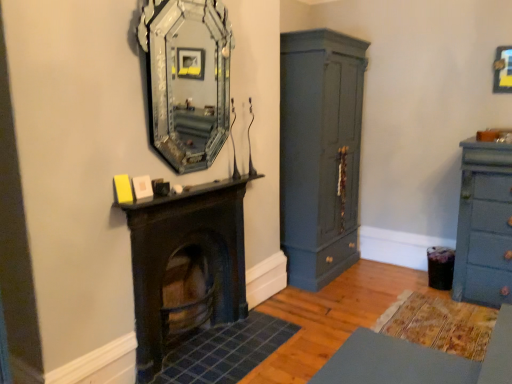
What do you see at coordinates (188, 79) in the screenshot?
I see `silver mirrored frame at upper center` at bounding box center [188, 79].

Where is `matte blue dresser at right`? matte blue dresser at right is located at coordinates (484, 225).

I want to click on dark wood fireplace at center, so click(x=186, y=266).

Image resolution: width=512 pixels, height=384 pixels. Identify the location of metallic gold picture frame at upper right. (503, 70).

The height and width of the screenshot is (384, 512). I want to click on chest of drawers below the silver mirrored frame at upper center (from the image's perspective), so click(x=484, y=225).

Looking at this image, from the image's perspective, is silver mirrored frame at upper center located above or below matte blue dresser at right?

Based on their image positions, silver mirrored frame at upper center is located above matte blue dresser at right.

Can you confirm if silver mirrored frame at upper center is wider than matte blue dresser at right?

No, silver mirrored frame at upper center is not wider than matte blue dresser at right.

Does point (169, 231) appear closer or farther from the camera than point (499, 90)?

Point (169, 231).

Is dark wood fireplace at center bigger than metallic gold picture frame at upper right?

Yes.

In terms of width, does dark wood fireplace at center look wider or thinner when compared to metallic gold picture frame at upper right?

dark wood fireplace at center is wider than metallic gold picture frame at upper right.

In the scene shown: What's the angular difference between dark wood fireplace at center and metallic gold picture frame at upper right's facing directions?

There is a 91-degree angle between the facing directions of dark wood fireplace at center and metallic gold picture frame at upper right.

Can you tell me how much matte dark blue cupboard at center right and matte blue dresser at right differ in facing direction?

89.9 degrees separate the facing orientations of matte dark blue cupboard at center right and matte blue dresser at right.

From the image's perspective, which one is positioned higher, matte dark blue cupboard at center right or matte blue dresser at right?

matte dark blue cupboard at center right appears higher in the image.

Is matte dark blue cupboard at center right not within matte blue dresser at right?

That's correct, matte dark blue cupboard at center right is outside of matte blue dresser at right.

Is matte dark blue cupboard at center right touching matte blue dresser at right?

No, matte dark blue cupboard at center right is not with matte blue dresser at right.

Is matte blue dresser at right at the left side of metallic gold picture frame at upper right?

Yes.

From a real-world perspective, which object rests below the other?

From a 3D spatial view, matte blue dresser at right is below.

Could you tell me if matte blue dresser at right is turned towards metallic gold picture frame at upper right?

No, matte blue dresser at right is not oriented towards metallic gold picture frame at upper right.

Are matte blue dresser at right and metallic gold picture frame at upper right located far from each other?

Yes, matte blue dresser at right and metallic gold picture frame at upper right are quite far apart.

Is silver mirrored frame at upper center at the left side of dark wood fireplace at center?

No.

Can you confirm if silver mirrored frame at upper center is smaller than dark wood fireplace at center?

Indeed, silver mirrored frame at upper center has a smaller size compared to dark wood fireplace at center.

This screenshot has width=512, height=384. In order to click on fireplace located below the silver mirrored frame at upper center (from the image's perspective) in this screenshot , I will do `click(186, 266)`.

Considering the sizes of silver mirrored frame at upper center and dark wood fireplace at center in the image, is silver mirrored frame at upper center taller or shorter than dark wood fireplace at center?

silver mirrored frame at upper center is taller than dark wood fireplace at center.

Which of these two, metallic gold picture frame at upper right or matte dark blue cupboard at center right, stands shorter?

metallic gold picture frame at upper right.

How many degrees apart are the facing directions of metallic gold picture frame at upper right and matte dark blue cupboard at center right?

They differ by 90.6 degrees in their facing directions.

Considering the sizes of metallic gold picture frame at upper right and matte dark blue cupboard at center right in the image, is metallic gold picture frame at upper right bigger or smaller than matte dark blue cupboard at center right?

Considering their sizes, metallic gold picture frame at upper right takes up less space than matte dark blue cupboard at center right.

Looking at this image, is metallic gold picture frame at upper right at the left side of matte dark blue cupboard at center right?

Incorrect, metallic gold picture frame at upper right is not on the left side of matte dark blue cupboard at center right.

In the image, is silver mirrored frame at upper center positioned in front of or behind metallic gold picture frame at upper right?

silver mirrored frame at upper center is positioned closer to the viewer than metallic gold picture frame at upper right.

From the image's perspective, is silver mirrored frame at upper center located above or below metallic gold picture frame at upper right?

From the image's perspective, silver mirrored frame at upper center appears below metallic gold picture frame at upper right.

Is point (184, 40) in front of point (507, 80)?

No, (184, 40) is behind (507, 80).

You are a GUI agent. You are given a task and a screenshot of the screen. Output one action in this format:
    pyautogui.click(x=<x>, y=<y>)
    Task: Click on the chest of drawers below the silver mirrored frame at upper center (from the image's perspective)
    
    Given the screenshot: What is the action you would take?
    pyautogui.click(x=484, y=225)

Find the location of a particular element. fireplace lying on the left of metallic gold picture frame at upper right is located at coordinates (186, 266).

Estimate the real-world distances between objects in this image. Which object is further from dark wood fireplace at center, matte blue dresser at right or matte dark blue cupboard at center right?

matte blue dresser at right is positioned further to the anchor dark wood fireplace at center.

Looking at this image, considering their positions, is matte dark blue cupboard at center right positioned closer to metallic gold picture frame at upper right than matte blue dresser at right?

matte blue dresser at right.

From the image, which object appears to be nearer to dark wood fireplace at center, metallic gold picture frame at upper right or matte dark blue cupboard at center right?

Based on the image, matte dark blue cupboard at center right appears to be nearer to dark wood fireplace at center.

From the image, which object appears to be farther from dark wood fireplace at center, matte dark blue cupboard at center right or metallic gold picture frame at upper right?

metallic gold picture frame at upper right lies further to dark wood fireplace at center than the other object.

Considering their positions, is dark wood fireplace at center positioned further to silver mirrored frame at upper center than metallic gold picture frame at upper right?

The object further to silver mirrored frame at upper center is metallic gold picture frame at upper right.

From the image, which object appears to be farther from matte blue dresser at right, metallic gold picture frame at upper right or dark wood fireplace at center?

dark wood fireplace at center is further to matte blue dresser at right.

Based on the photo, considering their positions, is matte blue dresser at right positioned further to metallic gold picture frame at upper right than dark wood fireplace at center?

The object further to metallic gold picture frame at upper right is dark wood fireplace at center.

From the image, which object appears to be nearer to matte blue dresser at right, silver mirrored frame at upper center or metallic gold picture frame at upper right?

metallic gold picture frame at upper right is positioned closer to the anchor matte blue dresser at right.

Identify the location of cupboard located between silver mirrored frame at upper center and metallic gold picture frame at upper right in the left-right direction. The height and width of the screenshot is (384, 512). (320, 153).

I want to click on mirror between dark wood fireplace at center and matte blue dresser at right in the horizontal direction, so click(188, 79).

Find the location of a particular element. chest of drawers between silver mirrored frame at upper center and metallic gold picture frame at upper right in the horizontal direction is located at coordinates (484, 225).

This screenshot has width=512, height=384. What are the coordinates of `chest of drawers between matte dark blue cupboard at center right and metallic gold picture frame at upper right from left to right` in the screenshot? It's located at (484, 225).